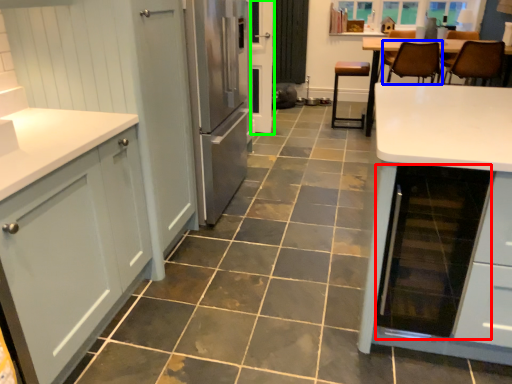
Question: Estimate the real-world distances between objects in this image. Which object is closer to appliance (highlighted by a red box), chair (highlighted by a blue box) or screen door (highlighted by a green box)?

Choices:
 (A) chair
 (B) screen door

Answer: (A)